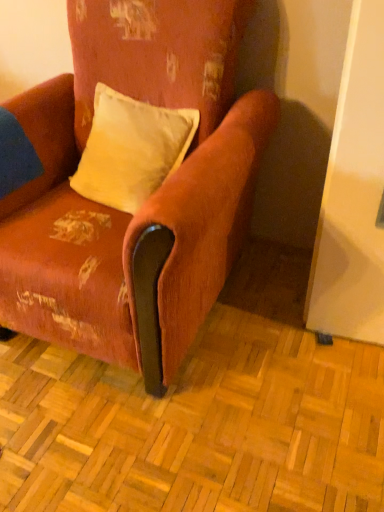
Measure the distance between velvet-like orange armchair at center and camera.

The distance of velvet-like orange armchair at center from camera is 32.86 inches.

What is the approximate height of velvet-like orange armchair at center?

It is 3.44 feet.

What are the coordinates of `velvet-like orange armchair at center` in the screenshot? It's located at (146, 202).

The width and height of the screenshot is (384, 512). Describe the element at coordinates (146, 202) in the screenshot. I see `velvet-like orange armchair at center` at that location.

Image resolution: width=384 pixels, height=512 pixels. What do you see at coordinates (131, 149) in the screenshot?
I see `velvet yellow pillow at center` at bounding box center [131, 149].

Where is `velvet yellow pillow at center`? The image size is (384, 512). velvet yellow pillow at center is located at coordinates tap(131, 149).

Where is `velvet-like orange armchair at center`? velvet-like orange armchair at center is located at coordinates (146, 202).

Is velvet yellow pillow at center to the left or to the right of velvet-like orange armchair at center in the image?

velvet yellow pillow at center is positioned on velvet-like orange armchair at center's right side.

In the image, is velvet yellow pillow at center positioned in front of or behind velvet-like orange armchair at center?

Visually, velvet yellow pillow at center is located behind velvet-like orange armchair at center.

Which is less distant, (87, 139) or (141, 89)?

Clearly, point (87, 139) is more distant from the camera than point (141, 89).

From the image's perspective, which object appears higher, velvet yellow pillow at center or velvet-like orange armchair at center?

From the image's view, velvet yellow pillow at center is above.

From a real-world perspective, is velvet yellow pillow at center over velvet-like orange armchair at center?

Correct, in the physical world, velvet yellow pillow at center is higher than velvet-like orange armchair at center.

Considering the sizes of velvet yellow pillow at center and velvet-like orange armchair at center in the image, is velvet yellow pillow at center wider or thinner than velvet-like orange armchair at center?

velvet yellow pillow at center is thinner than velvet-like orange armchair at center.

Which of these two, velvet yellow pillow at center or velvet-like orange armchair at center, stands taller?

velvet-like orange armchair at center.

Is velvet yellow pillow at center bigger or smaller than velvet-like orange armchair at center?

velvet yellow pillow at center is smaller than velvet-like orange armchair at center.

Is velvet-like orange armchair at center completely or partially inside velvet yellow pillow at center?

That's incorrect, velvet-like orange armchair at center is not inside velvet yellow pillow at center.

Is velvet yellow pillow at center not close to velvet-like orange armchair at center?

No.

Is velvet yellow pillow at center aimed at velvet-like orange armchair at center?

Yes, velvet yellow pillow at center is turned towards velvet-like orange armchair at center.

The image size is (384, 512). I want to click on chair that is in front of the velvet yellow pillow at center, so click(146, 202).

Looking at this image, can you confirm if velvet-like orange armchair at center is positioned to the left of velvet yellow pillow at center?

Correct, you'll find velvet-like orange armchair at center to the left of velvet yellow pillow at center.

Relative to velvet yellow pillow at center, is velvet-like orange armchair at center in front or behind?

Visually, velvet-like orange armchair at center is located in front of velvet yellow pillow at center.

Is point (261, 109) positioned behind point (116, 196)?

No, it is in front of (116, 196).

From the image's perspective, is velvet-like orange armchair at center above or below velvet yellow pillow at center?

Based on their image positions, velvet-like orange armchair at center is located beneath velvet yellow pillow at center.

From a real-world perspective, relative to velvet yellow pillow at center, is velvet-like orange armchair at center vertically above or below?

Clearly, from a real-world perspective, velvet-like orange armchair at center is below velvet yellow pillow at center.

Is velvet-like orange armchair at center thinner than velvet yellow pillow at center?

No.

From their relative heights in the image, would you say velvet-like orange armchair at center is taller or shorter than velvet yellow pillow at center?

In the image, velvet-like orange armchair at center appears to be taller than velvet yellow pillow at center.

Consider the image. Which of these two, velvet-like orange armchair at center or velvet yellow pillow at center, is smaller?

velvet yellow pillow at center.

Looking at this image, would you say velvet-like orange armchair at center is outside velvet yellow pillow at center?

Yes.

Is velvet-like orange armchair at center in contact with velvet yellow pillow at center?

No, velvet-like orange armchair at center is not touching velvet yellow pillow at center.

Is velvet-like orange armchair at center aimed at velvet yellow pillow at center?

Yes, velvet-like orange armchair at center is aimed at velvet yellow pillow at center.

How many degrees apart are the facing directions of velvet-like orange armchair at center and velvet yellow pillow at center?

The angular difference between velvet-like orange armchair at center and velvet yellow pillow at center is 9.75 degrees.

Identify the location of chair below the velvet yellow pillow at center (from the image's perspective). The width and height of the screenshot is (384, 512). pos(146,202).

Locate an element on the screen. chair directly beneath the velvet yellow pillow at center (from a real-world perspective) is located at coordinates (146, 202).

This screenshot has height=512, width=384. What are the coordinates of `chair below the velvet yellow pillow at center (from the image's perspective)` in the screenshot? It's located at (146, 202).